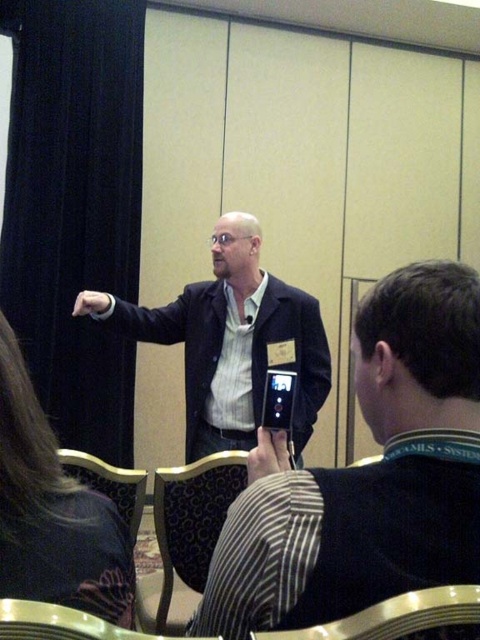
Question: Which object is the closest to the matte black suit at center?

Choices:
 (A) gold fabric chair at lower center
 (B) patterned fabric chair at lower left
 (C) patterned fabric chair at lower center

Answer: (C)

Question: Can you confirm if gold fabric chair at lower center is positioned below patterned fabric chair at lower left?

Choices:
 (A) yes
 (B) no

Answer: (B)

Question: Among these points, which one is nearest to the camera?

Choices:
 (A) (84, 460)
 (B) (285, 634)
 (C) (193, 403)

Answer: (B)

Question: Does matte black suit at center have a greater width compared to gold fabric chair at lower center?

Choices:
 (A) yes
 (B) no

Answer: (A)

Question: Is patterned fabric chair at lower center positioned at the back of patterned fabric chair at lower left?

Choices:
 (A) no
 (B) yes

Answer: (B)

Question: Which object is closer to the camera taking this photo?

Choices:
 (A) patterned fabric chair at lower center
 (B) patterned fabric chair at lower left
 (C) matte black suit at center

Answer: (B)